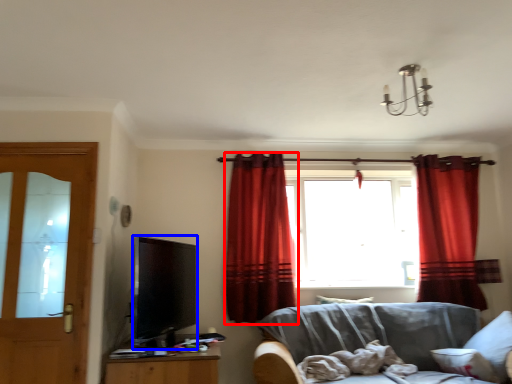
Question: Which point is further to the camera, curtain (highlighted by a red box) or television (highlighted by a blue box)?

Choices:
 (A) curtain
 (B) television

Answer: (A)